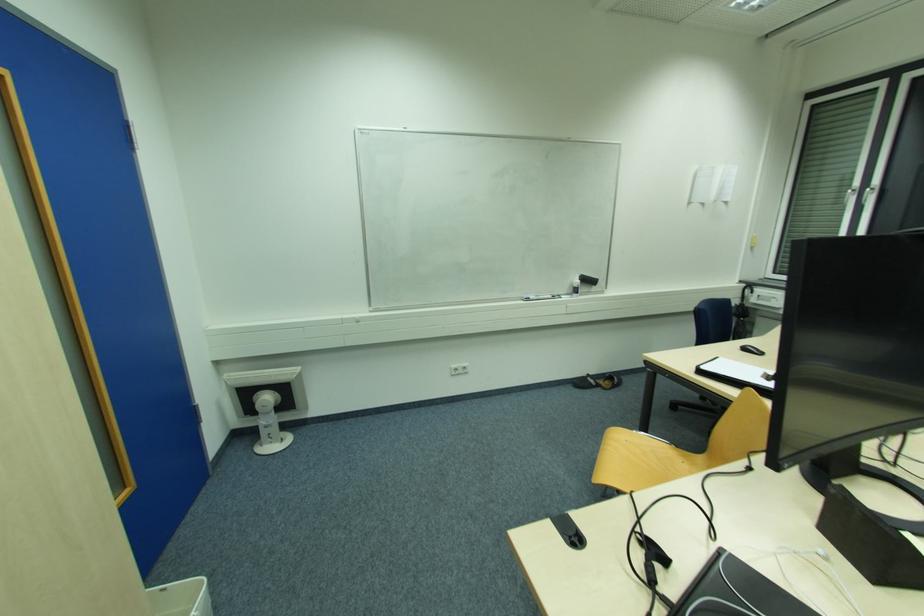
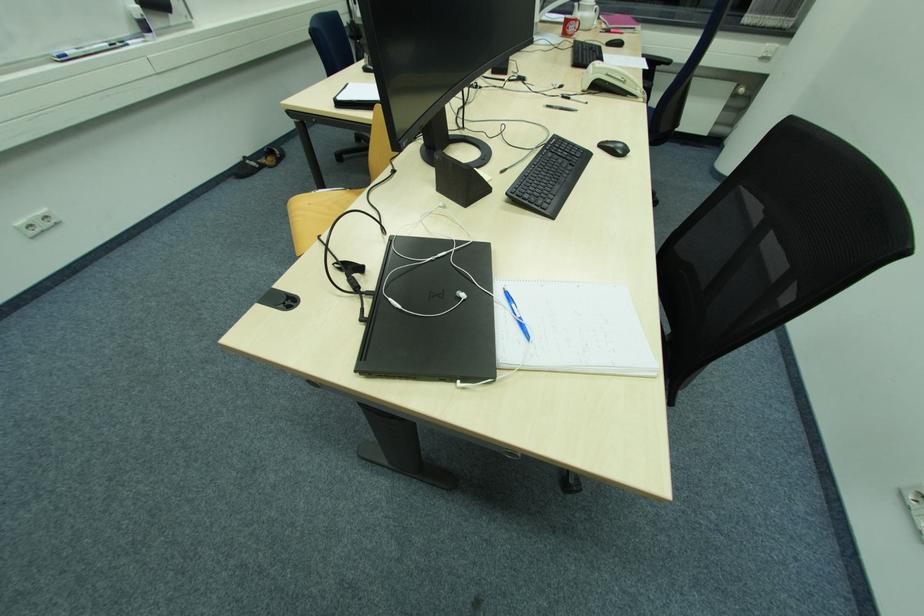
How did the camera likely rotate?

The camera's rotation is toward right-down.